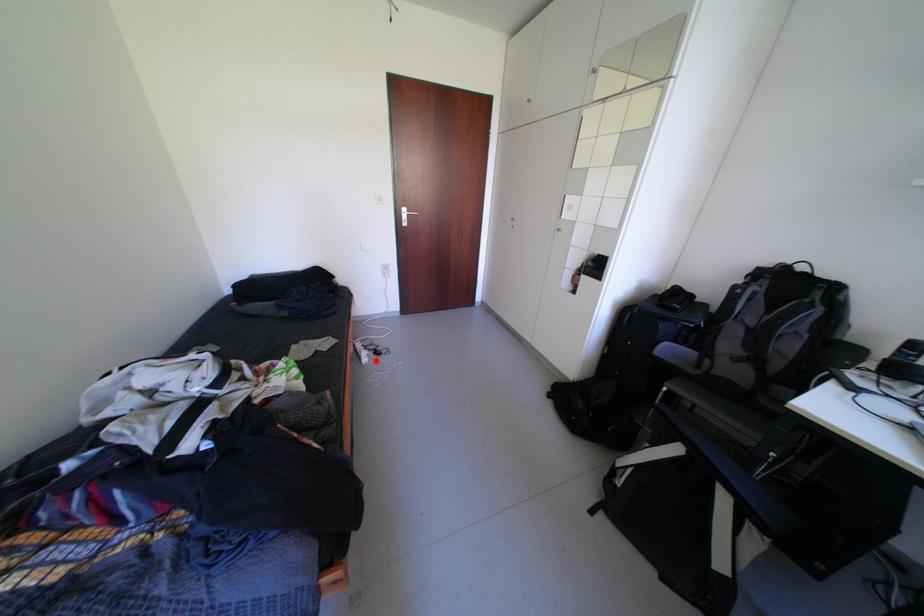
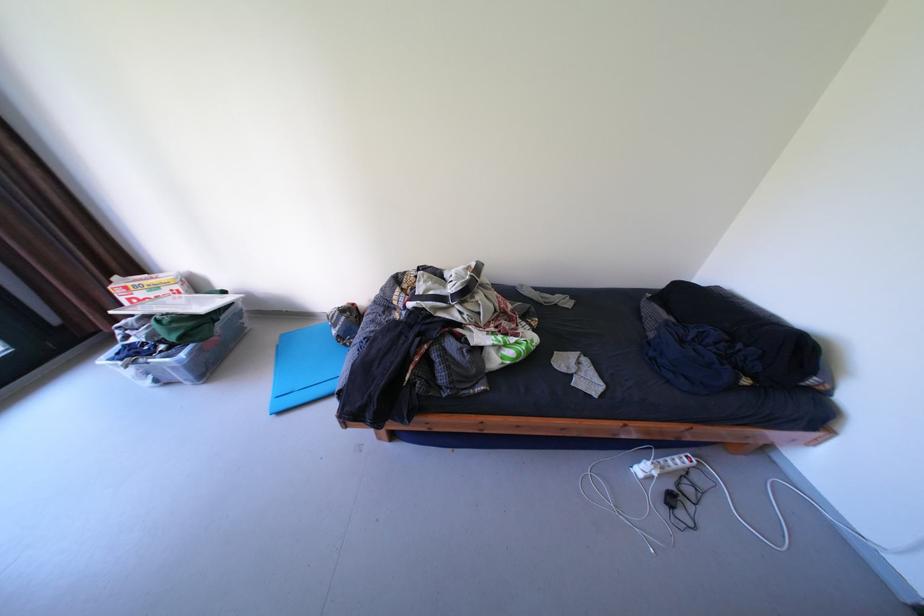
Locate, in the second image, the point that corresponds to the highlighted location in the first image.

(649, 471)